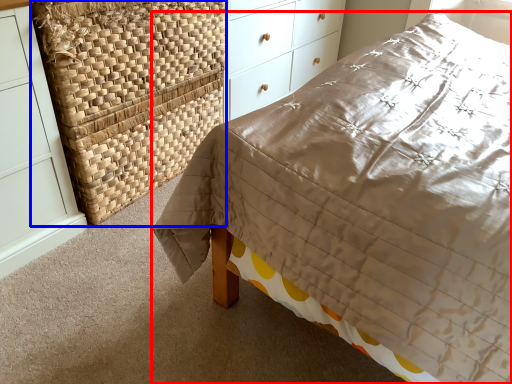
Question: Which of the following is the farthest to the observer, bed (highlighted by a red box) or basket (highlighted by a blue box)?

Choices:
 (A) bed
 (B) basket

Answer: (B)